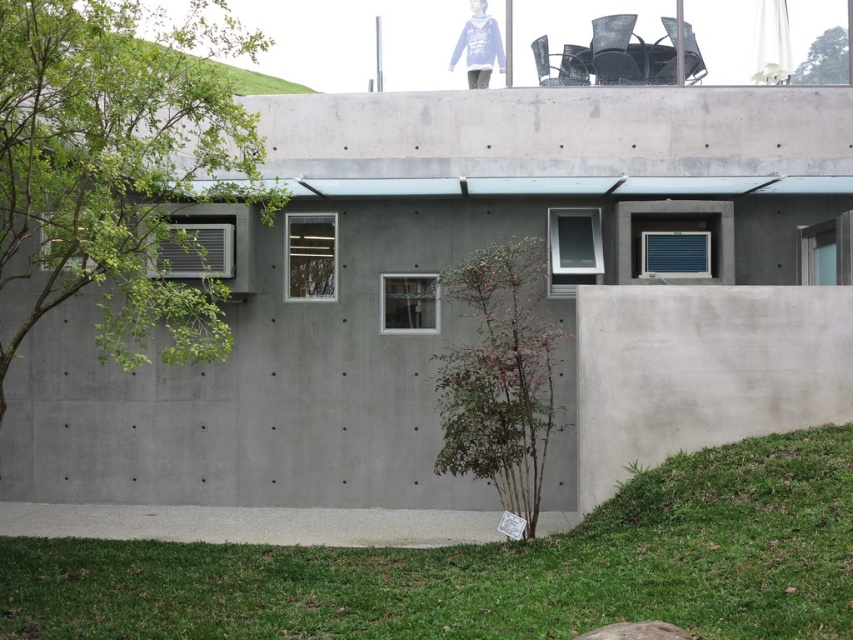
Which of these two, smooth concrete wall at lower right or green leafy tree at upper right, stands shorter?

green leafy tree at upper right

Does smooth concrete wall at lower right have a greater height compared to green leafy tree at upper right?

Yes.

What do you see at coordinates (701, 371) in the screenshot?
I see `smooth concrete wall at lower right` at bounding box center [701, 371].

Locate an element on the screen. smooth concrete wall at lower right is located at coordinates (701, 371).

Between point (637, 595) and point (548, 396), which one is positioned in front?

Point (637, 595) is more forward.

Consider the image. Can you confirm if green grass at lower center is positioned to the left of green matte tree at center?

Correct, you'll find green grass at lower center to the left of green matte tree at center.

Is point (577, 540) positioned in front of point (537, 481)?

That is True.

The height and width of the screenshot is (640, 853). Identify the location of green grass at lower center. (492, 566).

Who is positioned more to the right, smooth concrete wall at lower right or green matte tree at center?

smooth concrete wall at lower right

Is smooth concrete wall at lower right to the left of green matte tree at center from the viewer's perspective?

No, smooth concrete wall at lower right is not to the left of green matte tree at center.

Does point (776, 292) come behind point (479, 262)?

Yes.

Find the location of a particular element. This screenshot has height=640, width=853. smooth concrete wall at lower right is located at coordinates (701, 371).